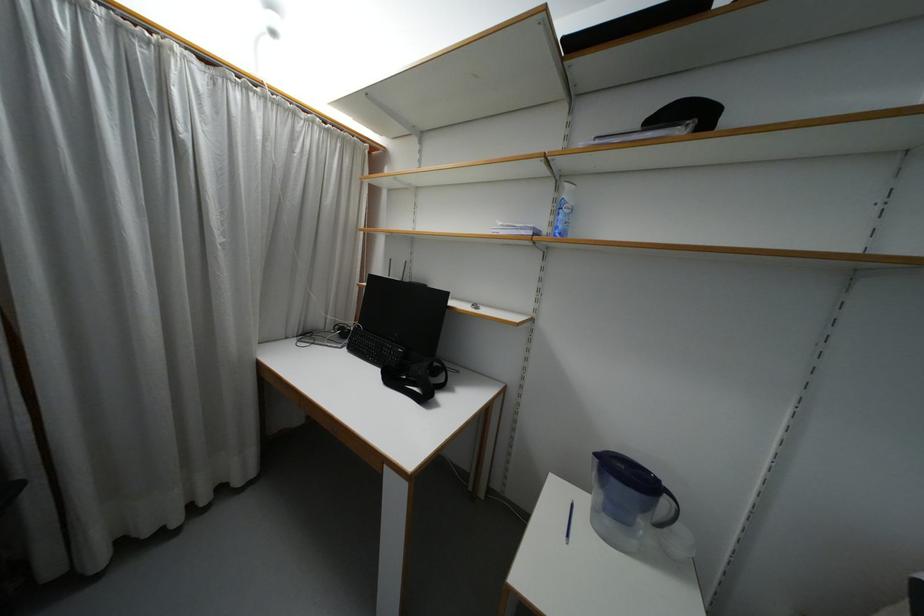
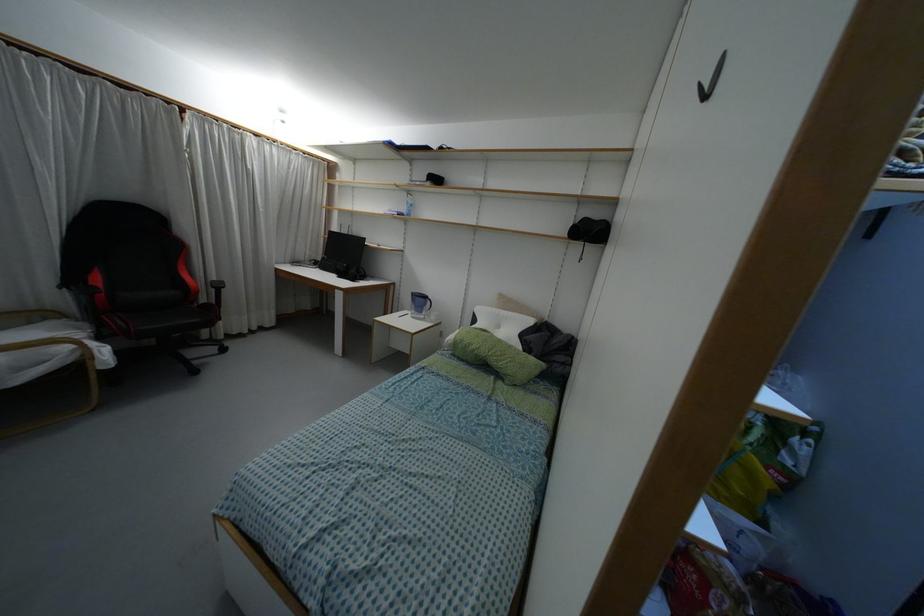
Locate, in the second image, the point that corresponds to (558,180) in the first image.

(407, 192)